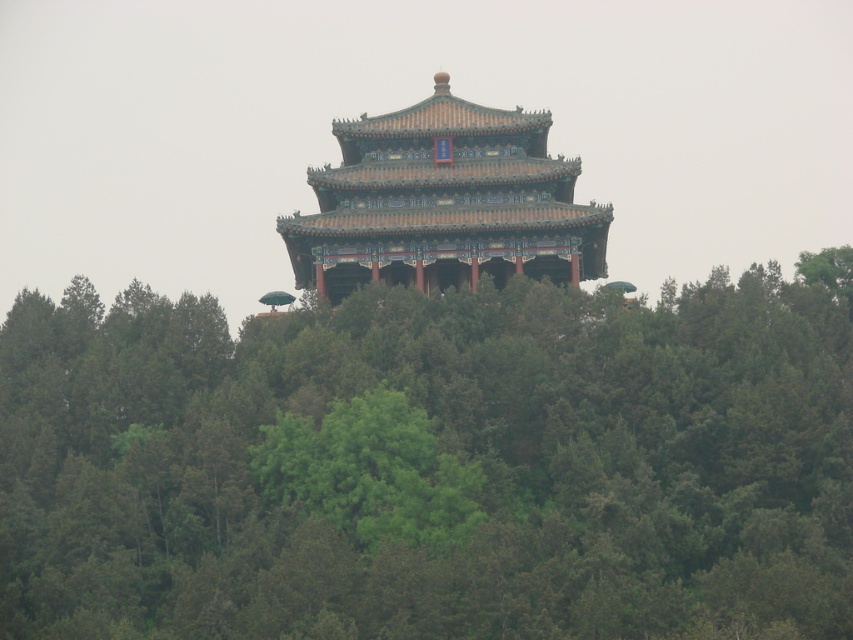
Question: Can you confirm if green leafy tree at center is positioned below shiny orange pagoda at center?

Choices:
 (A) yes
 (B) no

Answer: (A)

Question: Which of the following is the closest to the observer?

Choices:
 (A) shiny orange pagoda at center
 (B) green leafy tree at center

Answer: (B)

Question: Is green leafy tree at center bigger than shiny orange pagoda at center?

Choices:
 (A) no
 (B) yes

Answer: (B)

Question: Among these objects, which one is nearest to the camera?

Choices:
 (A) shiny orange pagoda at center
 (B) green leafy tree at center

Answer: (B)

Question: Does green leafy tree at center have a larger size compared to shiny orange pagoda at center?

Choices:
 (A) no
 (B) yes

Answer: (B)